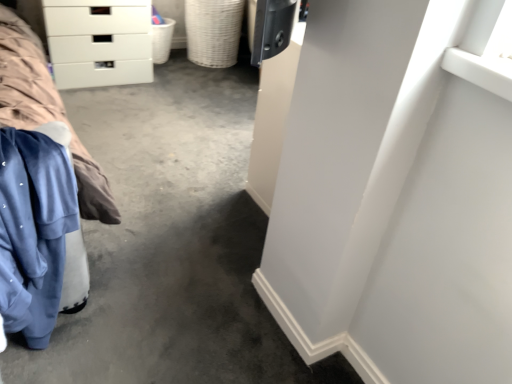
Question: Which direction should I rotate to look at woven beige basket at center, which is counted as the first basket, starting from the right?

Choices:
 (A) left
 (B) right

Answer: (A)

Question: From a real-world perspective, is blue fleece at left on white plastic basket at upper left, the 1th basket in the left-to-right sequence?

Choices:
 (A) no
 (B) yes

Answer: (B)

Question: Is blue fleece at left in front of white plastic basket at upper left, the 1th basket in the left-to-right sequence?

Choices:
 (A) no
 (B) yes

Answer: (B)

Question: Is blue fleece at left thinner than white plastic basket at upper left, which is the 2th basket from right to left?

Choices:
 (A) no
 (B) yes

Answer: (A)

Question: Is blue fleece at left surrounding white plastic basket at upper left, the 1th basket in the left-to-right sequence?

Choices:
 (A) no
 (B) yes

Answer: (A)

Question: Considering the relative sizes of blue fleece at left and white plastic basket at upper left, the 1th basket in the left-to-right sequence, in the image provided, is blue fleece at left taller than white plastic basket at upper left, the 1th basket in the left-to-right sequence,?

Choices:
 (A) yes
 (B) no

Answer: (A)

Question: Is blue fleece at left aimed at white plastic basket at upper left, the 1th basket in the left-to-right sequence?

Choices:
 (A) yes
 (B) no

Answer: (B)

Question: From a real-world perspective, is white glossy chest of drawers at upper left on top of white plastic basket at upper left, the 1th basket in the left-to-right sequence?

Choices:
 (A) yes
 (B) no

Answer: (A)

Question: Can you confirm if white glossy chest of drawers at upper left is wider than white plastic basket at upper left, which is the 2th basket from right to left?

Choices:
 (A) no
 (B) yes

Answer: (B)

Question: Does white glossy chest of drawers at upper left contain white plastic basket at upper left, which is the 2th basket from right to left?

Choices:
 (A) no
 (B) yes

Answer: (A)

Question: Can you confirm if white glossy chest of drawers at upper left is positioned to the right of white plastic basket at upper left, which is the 2th basket from right to left?

Choices:
 (A) no
 (B) yes

Answer: (A)

Question: From the image's perspective, would you say white glossy chest of drawers at upper left is shown under white plastic basket at upper left, the 1th basket in the left-to-right sequence?

Choices:
 (A) no
 (B) yes

Answer: (B)

Question: Is white glossy chest of drawers at upper left bigger than white plastic basket at upper left, the 1th basket in the left-to-right sequence?

Choices:
 (A) yes
 (B) no

Answer: (A)

Question: From the image's perspective, is white plastic basket at upper left, the 1th basket in the left-to-right sequence, located beneath white glossy chest of drawers at upper left?

Choices:
 (A) yes
 (B) no

Answer: (B)